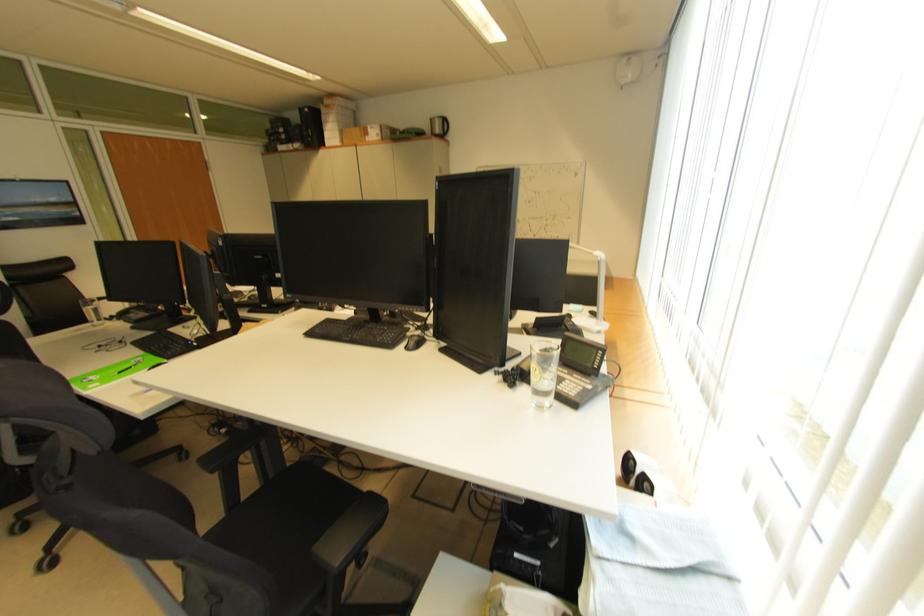
At what (x,y) coordinates should I click in order to perform the action: click on black computer mouse. Please return your answer as a coordinate pair (x, y). This screenshot has height=616, width=924. Looking at the image, I should click on (415, 341).